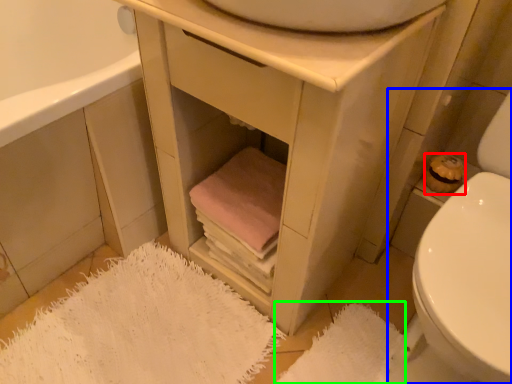
Question: Considering the real-world distances, which object is closest to toilet paper (highlighted by a red box)? toilet (highlighted by a blue box) or bath mat (highlighted by a green box).

Choices:
 (A) toilet
 (B) bath mat

Answer: (A)